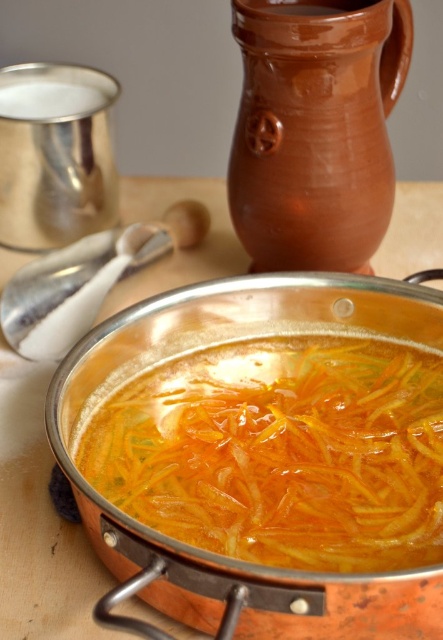
Does slightly translucent orange shredded carrots at center appear on the left side of shiny copper pot at center?

No, slightly translucent orange shredded carrots at center is not to the left of shiny copper pot at center.

Could you measure the distance between slightly translucent orange shredded carrots at center and shiny copper pot at center?

slightly translucent orange shredded carrots at center is 4.77 inches from shiny copper pot at center.

Is point (230, 545) positioned in front of point (69, 564)?

That is True.

This screenshot has height=640, width=443. I want to click on slightly translucent orange shredded carrots at center, so pyautogui.click(x=280, y=452).

Can you confirm if brown clay pitcher at upper center is thinner than white plastic spoon at upper left?

Yes.

Can you confirm if brown clay pitcher at upper center is taller than white plastic spoon at upper left?

Indeed, brown clay pitcher at upper center has a greater height compared to white plastic spoon at upper left.

Measure the distance between brown clay pitcher at upper center and camera.

brown clay pitcher at upper center is 17.45 inches away from camera.

Image resolution: width=443 pixels, height=640 pixels. In order to click on brown clay pitcher at upper center in this screenshot , I will do `click(315, 129)`.

Which is above, slightly translucent orange shredded carrots at center or brown clay pitcher at upper center?

brown clay pitcher at upper center is above.

Who is more forward, (291,458) or (405,19)?

Point (291,458)

Is point (193, 432) positioned in front of point (410, 33)?

Yes, point (193, 432) is closer to viewer.

This screenshot has height=640, width=443. In order to click on slightly translucent orange shredded carrots at center in this screenshot , I will do `click(280, 452)`.